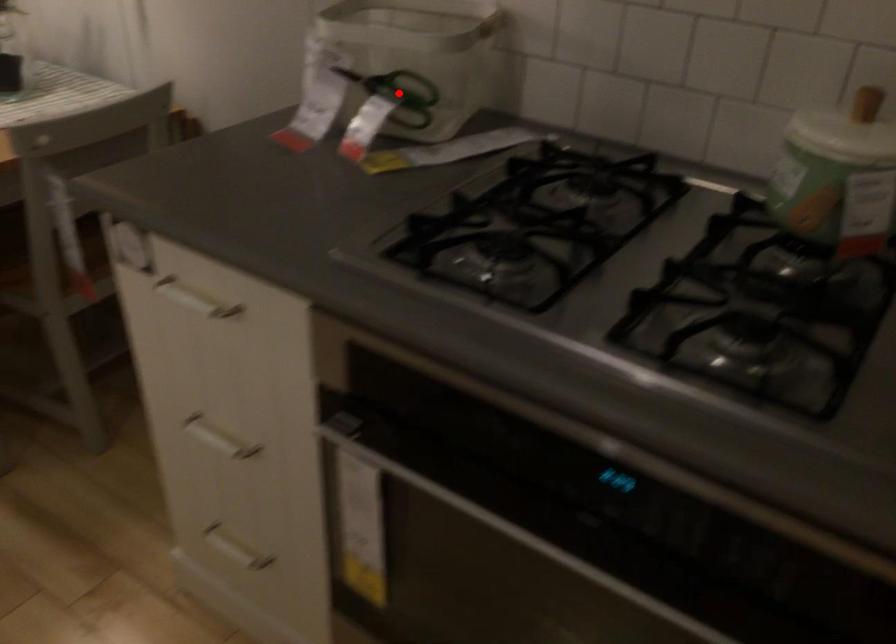
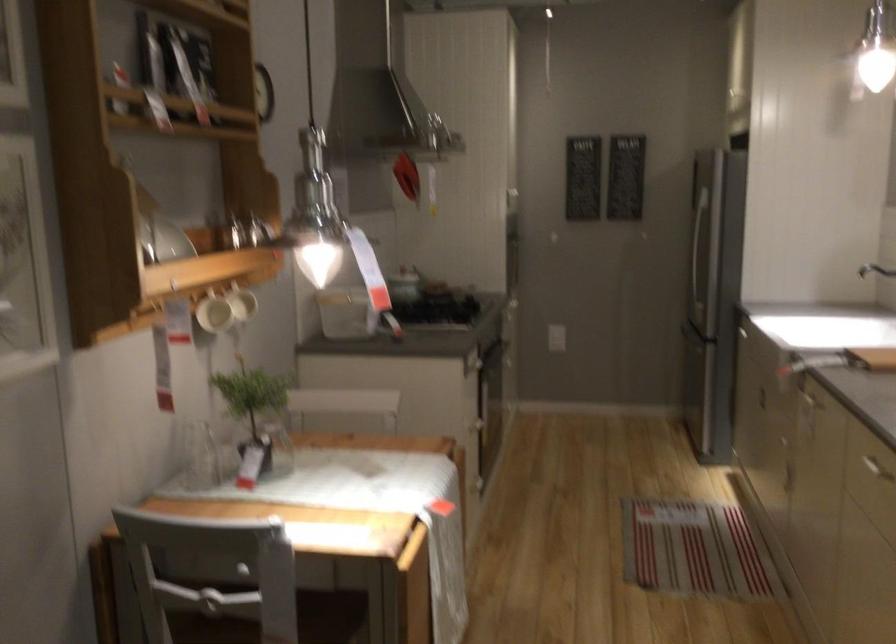
Question: I am providing you with two images of the same scene from different viewpoints. A red point is marked on the first image. Is the red point's position out of view in image 2?

Choices:
 (A) Yes
 (B) No

Answer: (A)